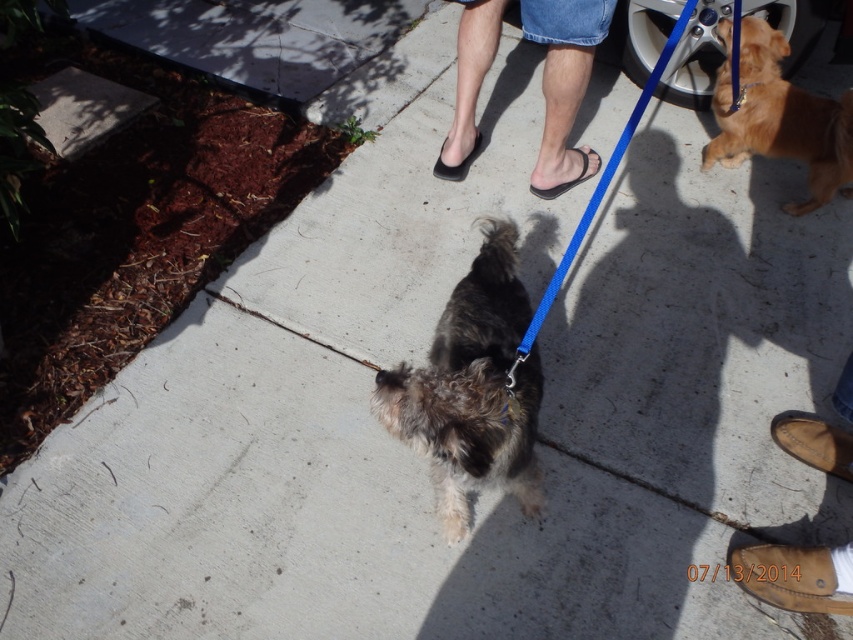
Can you confirm if brown leather sandal at lower right is thinner than black matte sandal at center?

No, brown leather sandal at lower right is not thinner than black matte sandal at center.

Is brown leather sandal at lower right smaller than black matte sandal at center?

Yes, brown leather sandal at lower right is smaller than black matte sandal at center.

Who is more forward, (770, 580) or (450, 179)?

Positioned in front is point (770, 580).

Where is `brown leather sandal at lower right`? Image resolution: width=853 pixels, height=640 pixels. brown leather sandal at lower right is located at coordinates (790, 577).

Between black leather sandals at center and brown leather shoes at lower right, which one is positioned higher?

black leather sandals at center is above.

Can you confirm if black leather sandals at center is taller than brown leather shoes at lower right?

Correct, black leather sandals at center is much taller as brown leather shoes at lower right.

Find the location of a particular element. The image size is (853, 640). black leather sandals at center is located at coordinates (563, 84).

What are the coordinates of `fuzzy brown dog at center` in the screenshot? It's located at (473, 388).

Which is behind, point (509, 465) or point (824, 604)?

The point (824, 604) is behind.

The height and width of the screenshot is (640, 853). Find the location of `fuzzy brown dog at center`. fuzzy brown dog at center is located at coordinates (473, 388).